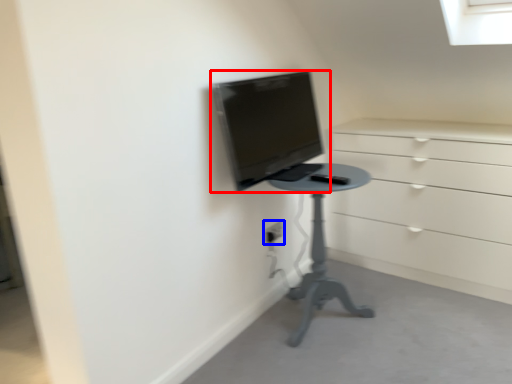
Question: Which point is closer to the camera, computer monitor (highlighted by a red box) or electric outlet (highlighted by a blue box)?

Choices:
 (A) computer monitor
 (B) electric outlet

Answer: (A)